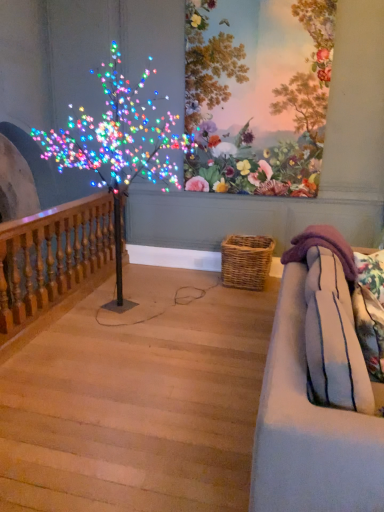
Question: Is wooden baluster at left further to the viewer compared to woven brown basket at lower center?

Choices:
 (A) yes
 (B) no

Answer: (B)

Question: Can you confirm if wooden baluster at left is wider than woven brown basket at lower center?

Choices:
 (A) no
 (B) yes

Answer: (A)

Question: From the image's perspective, is wooden baluster at left beneath woven brown basket at lower center?

Choices:
 (A) no
 (B) yes

Answer: (A)

Question: Is wooden baluster at left shorter than woven brown basket at lower center?

Choices:
 (A) yes
 (B) no

Answer: (B)

Question: Is wooden baluster at left thinner than woven brown basket at lower center?

Choices:
 (A) no
 (B) yes

Answer: (B)

Question: In terms of size, does floral wallpaper at upper center appear bigger or smaller than light wood stairwell at lower left?

Choices:
 (A) small
 (B) big

Answer: (A)

Question: Is floral wallpaper at upper center in front of or behind light wood stairwell at lower left in the image?

Choices:
 (A) behind
 (B) front

Answer: (A)

Question: In the image, is floral wallpaper at upper center on the left side or the right side of light wood stairwell at lower left?

Choices:
 (A) right
 (B) left

Answer: (A)

Question: From the image's perspective, is floral wallpaper at upper center located above or below light wood stairwell at lower left?

Choices:
 (A) above
 (B) below

Answer: (A)

Question: Would you say light blue fabric couch at right is to the left or to the right of light wood stairwell at lower left in the picture?

Choices:
 (A) left
 (B) right

Answer: (B)

Question: Would you say light blue fabric couch at right is inside or outside light wood stairwell at lower left?

Choices:
 (A) inside
 (B) outside

Answer: (B)

Question: Is point (377, 458) closer or farther from the camera than point (29, 429)?

Choices:
 (A) closer
 (B) farther

Answer: (A)

Question: In terms of width, does light blue fabric couch at right look wider or thinner when compared to light wood stairwell at lower left?

Choices:
 (A) wide
 (B) thin

Answer: (B)

Question: Is floral wallpaper at upper center inside or outside of wooden baluster at left?

Choices:
 (A) inside
 (B) outside

Answer: (B)

Question: From a real-world perspective, relative to wooden baluster at left, is floral wallpaper at upper center vertically above or below?

Choices:
 (A) above
 (B) below

Answer: (A)